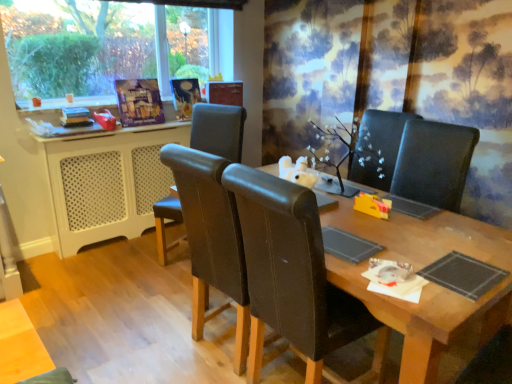
Question: From the image's perspective, is leather at center, arranged as the 2th chair when viewed from the right, located beneath wooden table at center?

Choices:
 (A) no
 (B) yes

Answer: (A)

Question: From a real-world perspective, is leather at center, arranged as the 2th chair when viewed from the right, physically below wooden table at center?

Choices:
 (A) yes
 (B) no

Answer: (B)

Question: From the image's perspective, would you say leather at center, which is counted as the 2th chair, starting from the front, is positioned over wooden table at center?

Choices:
 (A) no
 (B) yes

Answer: (B)

Question: Considering the relative sizes of leather at center, which appears as the 1th chair when viewed from the back, and wooden table at center in the image provided, is leather at center, which appears as the 1th chair when viewed from the back, taller than wooden table at center?

Choices:
 (A) yes
 (B) no

Answer: (A)

Question: Could you tell me if leather at center, arranged as the 2th chair when viewed from the right, is turned towards wooden table at center?

Choices:
 (A) no
 (B) yes

Answer: (A)

Question: Considering the relative positions of brown leather chair at center, which appears as the 2th chair when viewed from the left, and leather at center, which appears as the 1th chair when viewed from the back, in the image provided, is brown leather chair at center, which appears as the 2th chair when viewed from the left, to the left or to the right of leather at center, which appears as the 1th chair when viewed from the back,?

Choices:
 (A) right
 (B) left

Answer: (A)

Question: Which is correct: brown leather chair at center, which appears as the 2th chair when viewed from the left, is inside leather at center, arranged as the 2th chair when viewed from the right, or outside of it?

Choices:
 (A) outside
 (B) inside

Answer: (A)

Question: Is point (249, 188) positioned closer to the camera than point (205, 124)?

Choices:
 (A) farther
 (B) closer

Answer: (B)

Question: From a real-world perspective, relative to leather at center, arranged as the 2th chair when viewed from the right, is brown leather chair at center, which appears as the 2th chair when viewed from the left, vertically above or below?

Choices:
 (A) above
 (B) below

Answer: (B)

Question: Considering the positions of point (223, 134) and point (59, 223), is point (223, 134) closer or farther from the camera than point (59, 223)?

Choices:
 (A) closer
 (B) farther

Answer: (A)

Question: In the image, is leather at center, which is counted as the 2th chair, starting from the front, positioned in front of or behind white perforated plastic at left?

Choices:
 (A) behind
 (B) front

Answer: (B)

Question: From a real-world perspective, is leather at center, which appears as the 1th chair when viewed from the back, above or below white perforated plastic at left?

Choices:
 (A) above
 (B) below

Answer: (A)

Question: In terms of size, does leather at center, which is counted as the 2th chair, starting from the front, appear bigger or smaller than white perforated plastic at left?

Choices:
 (A) small
 (B) big

Answer: (B)

Question: Considering the positions of brown leather chair at center, which appears as the 2th chair when viewed from the left, and white perforated plastic at left in the image, is brown leather chair at center, which appears as the 2th chair when viewed from the left, wider or thinner than white perforated plastic at left?

Choices:
 (A) thin
 (B) wide

Answer: (B)

Question: Is brown leather chair at center, positioned as the 1th chair in right-to-left order, taller or shorter than white perforated plastic at left?

Choices:
 (A) short
 (B) tall

Answer: (B)